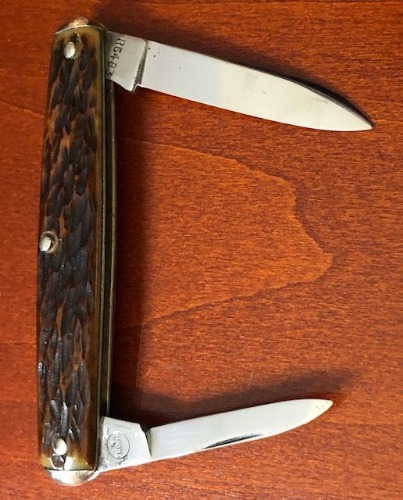
In order to click on wood grains in this screenshot , I will do tap(149, 140), tap(185, 309), tap(15, 342), tap(353, 424).